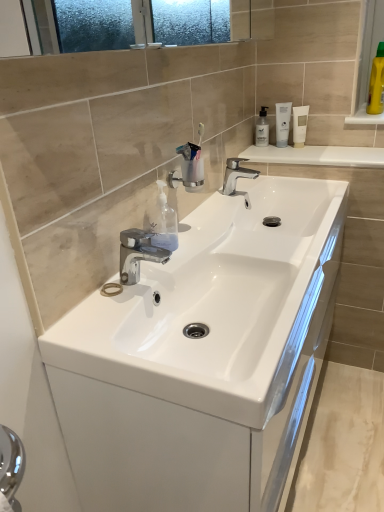
Question: Is yellow plastic bottle at upper right, the third mouthwash from the left, located outside polished chrome tap at center, marked as the 1th tap in a top-to-bottom arrangement?

Choices:
 (A) no
 (B) yes

Answer: (B)

Question: Considering the relative sizes of yellow plastic bottle at upper right, the third mouthwash from the left, and polished chrome tap at center, arranged as the first tap when viewed from the right, in the image provided, is yellow plastic bottle at upper right, the third mouthwash from the left, smaller than polished chrome tap at center, arranged as the first tap when viewed from the right,?

Choices:
 (A) no
 (B) yes

Answer: (A)

Question: Is yellow plastic bottle at upper right, the third mouthwash from the left, at the left side of polished chrome tap at center, the 2th tap when ordered from left to right?

Choices:
 (A) yes
 (B) no

Answer: (B)

Question: Is polished chrome tap at center, arranged as the second tap when ordered from the bottom, inside yellow plastic bottle at upper right, the third mouthwash from the left?

Choices:
 (A) yes
 (B) no

Answer: (B)

Question: From the image's perspective, is yellow plastic bottle at upper right, which is the first mouthwash from right to left, beneath polished chrome tap at center, which is the 2th tap in front-to-back order?

Choices:
 (A) yes
 (B) no

Answer: (B)

Question: Does yellow plastic bottle at upper right, the third mouthwash from the left, have a larger size compared to polished chrome tap at center, positioned as the first tap in back-to-front order?

Choices:
 (A) yes
 (B) no

Answer: (A)

Question: Does yellow plastic bottle at upper right, the third mouthwash from the left, have a lesser width compared to white glossy countertop at upper center?

Choices:
 (A) no
 (B) yes

Answer: (B)

Question: From a real-world perspective, is yellow plastic bottle at upper right, the third mouthwash from the left, over white glossy countertop at upper center?

Choices:
 (A) yes
 (B) no

Answer: (A)

Question: Are yellow plastic bottle at upper right, the third mouthwash from the left, and white glossy countertop at upper center far apart?

Choices:
 (A) no
 (B) yes

Answer: (A)

Question: Can you confirm if yellow plastic bottle at upper right, which is the first mouthwash from right to left, is wider than white glossy countertop at upper center?

Choices:
 (A) yes
 (B) no

Answer: (B)

Question: From a real-world perspective, is yellow plastic bottle at upper right, the third mouthwash from the left, located beneath white glossy countertop at upper center?

Choices:
 (A) yes
 (B) no

Answer: (B)

Question: Is yellow plastic bottle at upper right, the third mouthwash from the left, outside white glossy countertop at upper center?

Choices:
 (A) yes
 (B) no

Answer: (A)

Question: Can you confirm if transparent plastic soap dispenser at center is taller than white matte tube at upper right, which is the 3th mouthwash in right-to-left order?

Choices:
 (A) yes
 (B) no

Answer: (B)